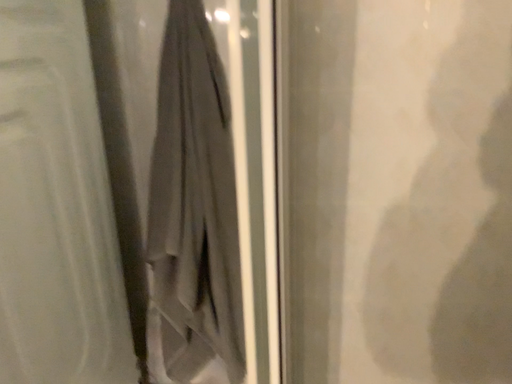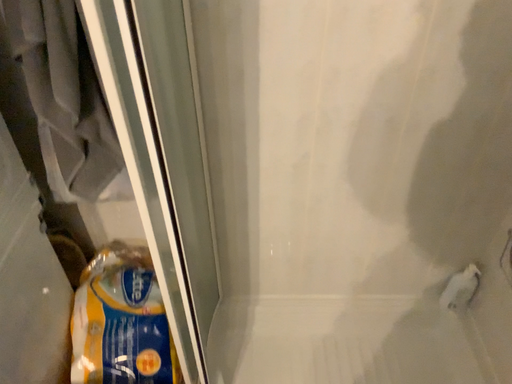
Question: How did the camera likely rotate when shooting the video?

Choices:
 (A) rotated right
 (B) rotated left

Answer: (A)